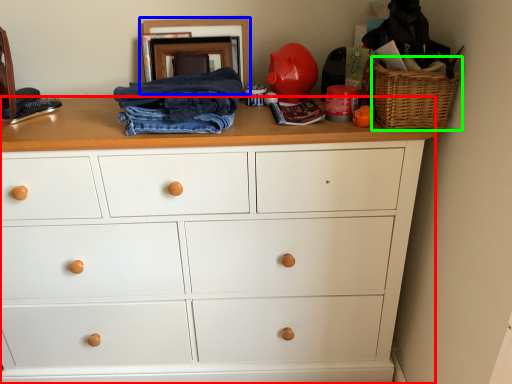
Question: Estimate the real-world distances between objects in this image. Which object is farther from chest of drawers (highlighted by a red box), picture frame (highlighted by a blue box) or basket (highlighted by a green box)?

Choices:
 (A) picture frame
 (B) basket

Answer: (A)